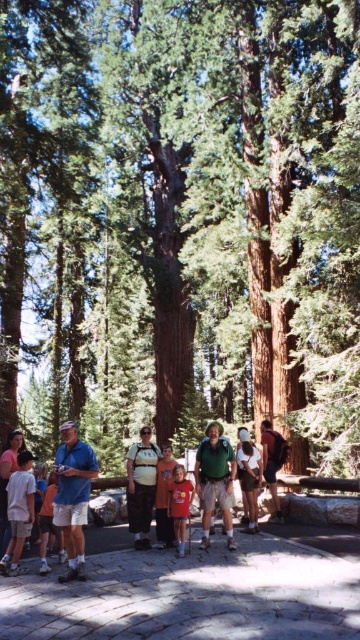
You are a photographer trying to capture a photo of the light blue shirt at lower left and the dark brown leather backpack at center. Which object should you focus on first if you want to ensure both are in sharp focus, considering their sizes?

The light blue shirt at lower left is bigger than the dark brown leather backpack at center, so you should focus on the light blue shirt at lower left first to ensure both are in sharp focus.

You are a photographer positioned at the edge of the forest scene. You want to capture a wide shot that includes both the light blue shirt at lower left and the dark brown leather backpack at center. Considering their sizes, which object should you frame first to ensure both fit in the shot?

The light blue shirt at lower left is wider than the dark brown leather backpack at center, so you should frame the light blue shirt at lower left first to accommodate its larger size, ensuring both fit in the shot.